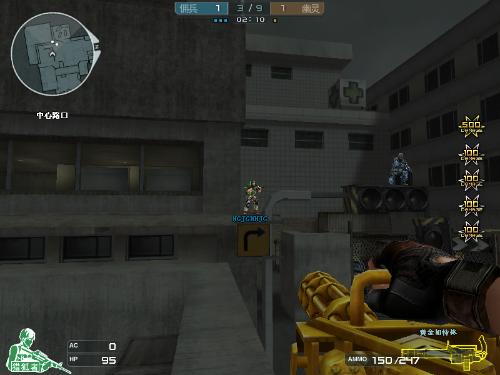
Where is `ac box`? ac box is located at coordinates (85, 348).